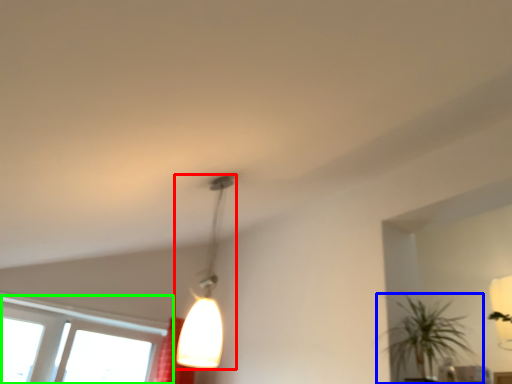
Question: Which is farther away from lamp (highlighted by a red box)? houseplant (highlighted by a blue box) or window (highlighted by a green box)?

Choices:
 (A) houseplant
 (B) window

Answer: (B)